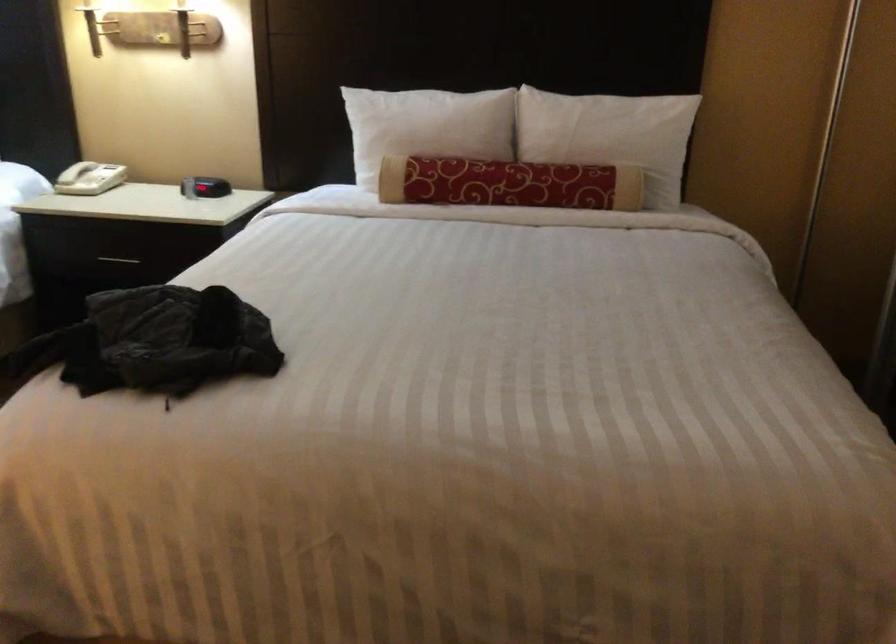
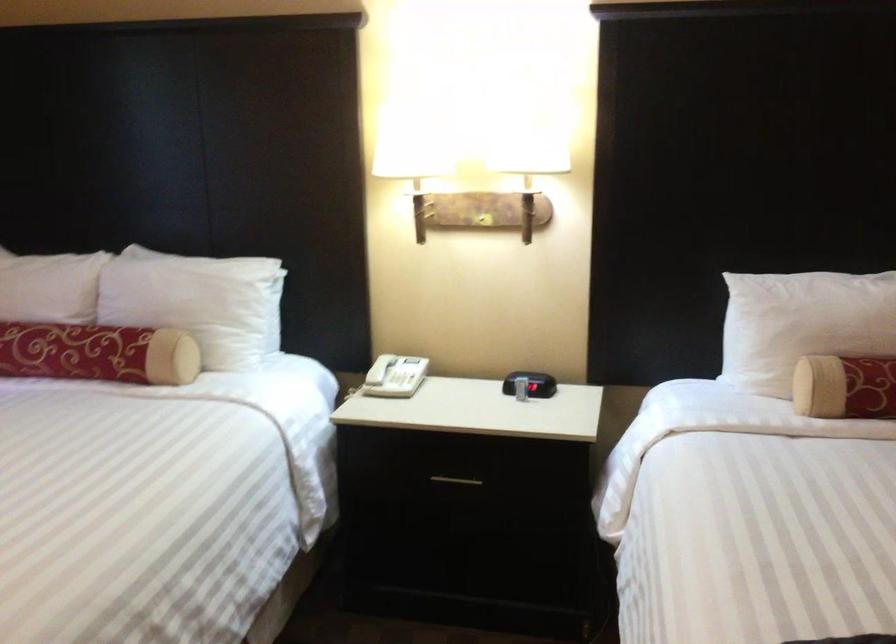
The point at (116, 257) is marked in the first image. Where is the corresponding point in the second image?

(455, 480)